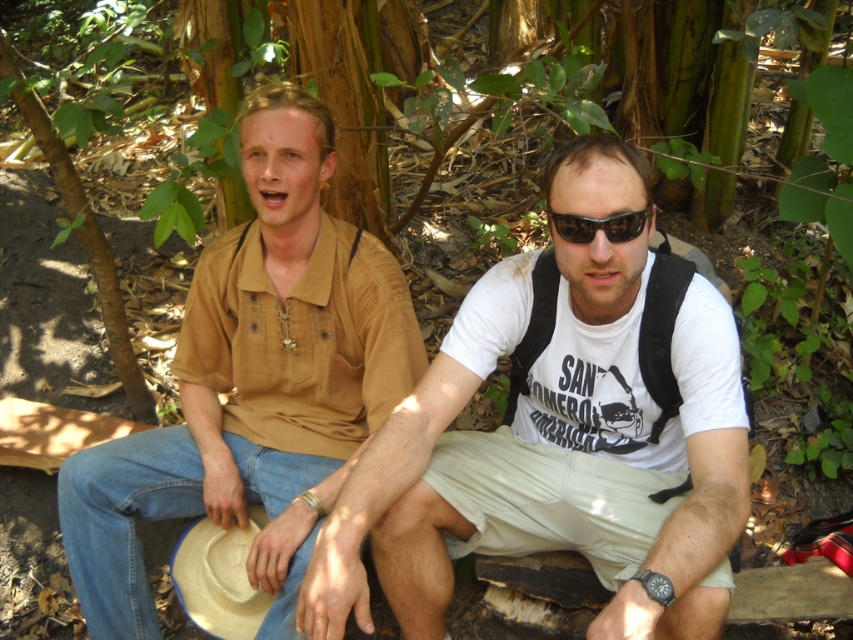
Question: Is the position of white cotton t-shirt at center more distant than that of black plastic sunglasses at center?

Choices:
 (A) no
 (B) yes

Answer: (A)

Question: Which object is positioned farthest from the white cotton t-shirt at center?

Choices:
 (A) black plastic sunglasses at center
 (B) matte brown shirt at left

Answer: (B)

Question: Is white cotton t-shirt at center below matte brown shirt at left?

Choices:
 (A) yes
 (B) no

Answer: (A)

Question: Which point appears closest to the camera in this image?

Choices:
 (A) (682, 596)
 (B) (614, 224)
 (C) (292, 244)

Answer: (A)

Question: Which is nearer to the black plastic sunglasses at center?

Choices:
 (A) matte brown shirt at left
 (B) white cotton t-shirt at center

Answer: (B)

Question: Does white cotton t-shirt at center come in front of matte brown shirt at left?

Choices:
 (A) no
 (B) yes

Answer: (B)